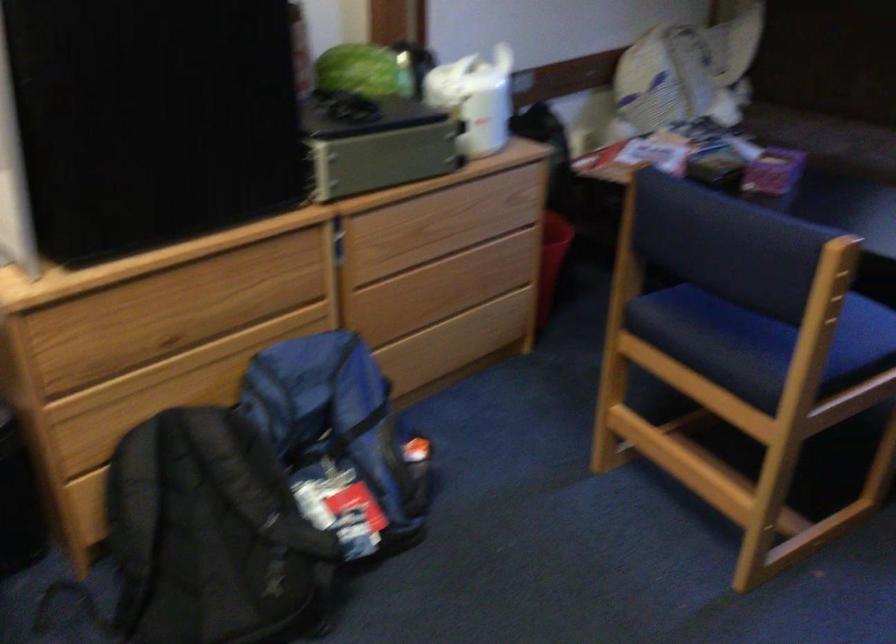
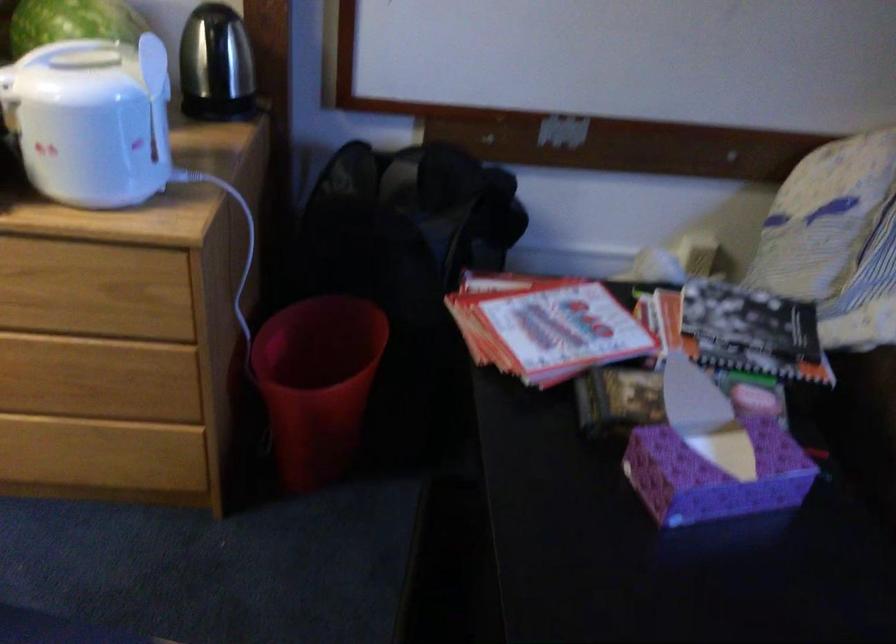
Locate, in the second image, the point that corresponds to point (493, 93) in the first image.

(91, 120)